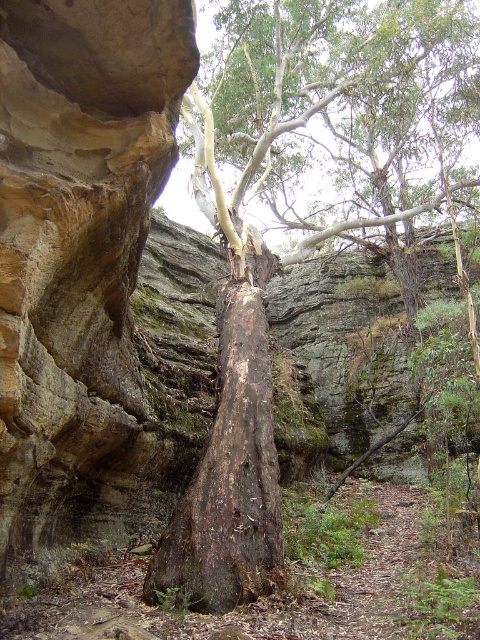
Question: Is dark brown bark tree at center to the right of dark brown rough bark tree trunk at center from the viewer's perspective?

Choices:
 (A) yes
 (B) no

Answer: (A)

Question: In this image, where is dark brown bark tree at center located relative to dark brown rough bark tree trunk at center?

Choices:
 (A) above
 (B) below

Answer: (A)

Question: Which point is closer to the camera?

Choices:
 (A) dark brown bark tree at center
 (B) dark brown rough bark tree trunk at center

Answer: (A)

Question: Which of the following is the farthest from the observer?

Choices:
 (A) dark brown rough bark tree trunk at center
 (B) dark brown bark tree at center

Answer: (A)

Question: In this image, where is dark brown bark tree at center located relative to dark brown rough bark tree trunk at center?

Choices:
 (A) left
 (B) right

Answer: (B)